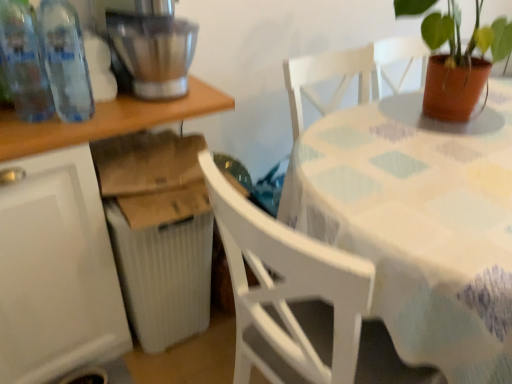
Question: From the image's perspective, does white fabric-covered table at center, the 1th table when ordered from right to left, appear higher than transparent plastic bottles at left, which is counted as the first bottle, starting from the right?

Choices:
 (A) no
 (B) yes

Answer: (A)

Question: Is white fabric-covered table at center, the second table when ordered from left to right, at the left side of transparent plastic bottles at left, the second bottle positioned from the left?

Choices:
 (A) no
 (B) yes

Answer: (A)

Question: Is white fabric-covered table at center, the second table when ordered from left to right, aimed at transparent plastic bottles at left, which is counted as the first bottle, starting from the right?

Choices:
 (A) yes
 (B) no

Answer: (B)

Question: Is white fabric-covered table at center, the second table when ordered from left to right, not inside transparent plastic bottles at left, the second bottle positioned from the left?

Choices:
 (A) yes
 (B) no

Answer: (A)

Question: Is white fabric-covered table at center, the 1th table when ordered from right to left, wider than transparent plastic bottles at left, which is counted as the first bottle, starting from the right?

Choices:
 (A) yes
 (B) no

Answer: (A)

Question: Relative to white fabric-covered table at center, the 1th table when ordered from right to left, is brushed metal mixer at upper left in front or behind?

Choices:
 (A) behind
 (B) front

Answer: (A)

Question: From the image's perspective, is brushed metal mixer at upper left above or below white fabric-covered table at center, the second table when ordered from left to right?

Choices:
 (A) below
 (B) above

Answer: (B)

Question: In terms of height, does brushed metal mixer at upper left look taller or shorter compared to white fabric-covered table at center, the 1th table when ordered from right to left?

Choices:
 (A) short
 (B) tall

Answer: (A)

Question: Is brushed metal mixer at upper left inside or outside of white fabric-covered table at center, the 1th table when ordered from right to left?

Choices:
 (A) outside
 (B) inside

Answer: (A)

Question: From a real-world perspective, is terracotta pot at table physically located above or below white plastic table at lower left, positioned as the second table in right-to-left order?

Choices:
 (A) below
 (B) above

Answer: (B)

Question: Is terracotta pot at table spatially inside white plastic table at lower left, positioned as the second table in right-to-left order, or outside of it?

Choices:
 (A) inside
 (B) outside

Answer: (B)

Question: Relative to white plastic table at lower left, positioned as the second table in right-to-left order, is terracotta pot at table in front or behind?

Choices:
 (A) front
 (B) behind

Answer: (B)

Question: From the image's perspective, is terracotta pot at table positioned above or below white plastic table at lower left, placed as the first table when sorted from left to right?

Choices:
 (A) below
 (B) above

Answer: (B)

Question: From a real-world perspective, is white plastic table at lower left, positioned as the second table in right-to-left order, positioned above or below transparent plastic bottles at left, which is counted as the first bottle, starting from the right?

Choices:
 (A) below
 (B) above

Answer: (A)

Question: Considering the positions of white plastic table at lower left, placed as the first table when sorted from left to right, and transparent plastic bottles at left, the second bottle positioned from the left, in the image, is white plastic table at lower left, placed as the first table when sorted from left to right, bigger or smaller than transparent plastic bottles at left, the second bottle positioned from the left,?

Choices:
 (A) big
 (B) small

Answer: (A)